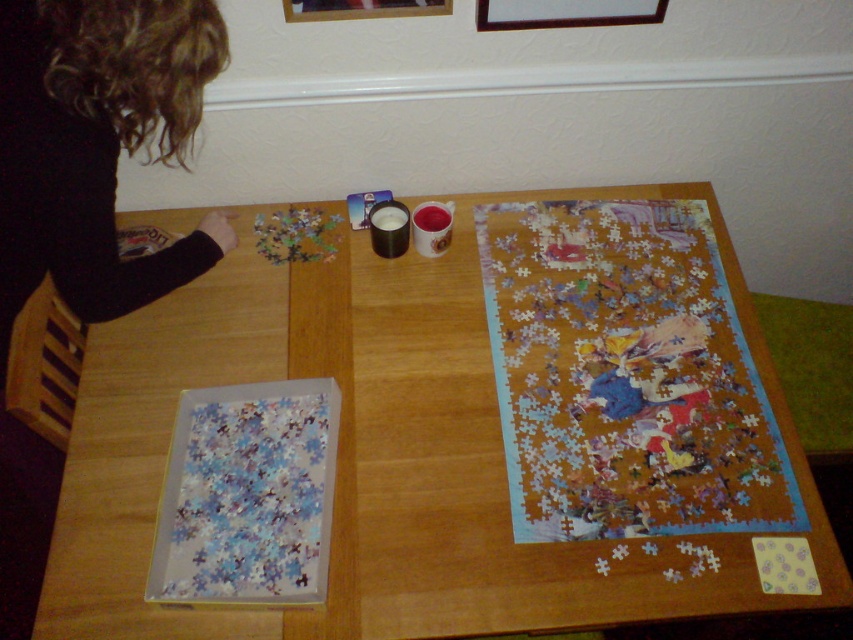
Who is positioned more to the right, wooden table at center or brushed metal picture frame at upper center?

wooden table at center

Who is lower down, wooden table at center or brushed metal picture frame at upper center?

wooden table at center is lower down.

Where is `wooden table at center`? The width and height of the screenshot is (853, 640). wooden table at center is located at coordinates (378, 458).

Does point (664, 8) come farther from viewer compared to point (334, 4)?

Yes, point (664, 8) is behind point (334, 4).

Can you confirm if wooden picture frame at upper center is smaller than brushed metal picture frame at upper center?

No.

Between point (660, 12) and point (318, 10), which one is positioned behind?

The point (660, 12) is behind.

Image resolution: width=853 pixels, height=640 pixels. I want to click on wooden picture frame at upper center, so click(566, 12).

Who is more forward, (641, 243) or (607, 19)?

Point (607, 19)

Does multicolored paper puzzle at right have a larger size compared to wooden picture frame at upper center?

Yes.

At what (x,y) coordinates should I click in order to perform the action: click on multicolored paper puzzle at right. Please return your answer as a coordinate pair (x, y). This screenshot has width=853, height=640. Looking at the image, I should click on (625, 376).